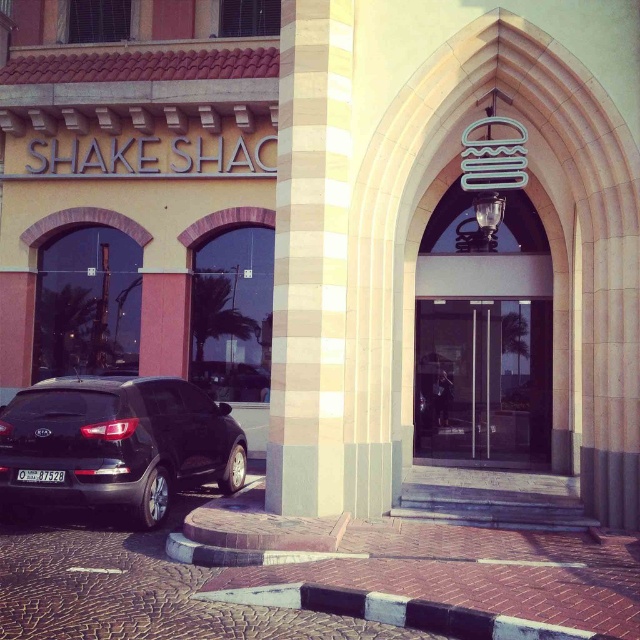
Question: Considering the real-world distances, which object is farthest from the beige stone column at center?

Choices:
 (A) shiny black suv at lower left
 (B) transparent glass doors at center

Answer: (B)

Question: Does beige stone column at center appear under shiny black suv at lower left?

Choices:
 (A) yes
 (B) no

Answer: (B)

Question: Does beige stone column at center appear over shiny black suv at lower left?

Choices:
 (A) no
 (B) yes

Answer: (B)

Question: Which object appears closest to the camera in this image?

Choices:
 (A) shiny black suv at lower left
 (B) transparent glass doors at center

Answer: (A)

Question: Can you confirm if shiny black suv at lower left is positioned above transparent glass doors at center?

Choices:
 (A) no
 (B) yes

Answer: (A)

Question: Which point is closer to the camera?

Choices:
 (A) (296, 381)
 (B) (490, 448)

Answer: (A)